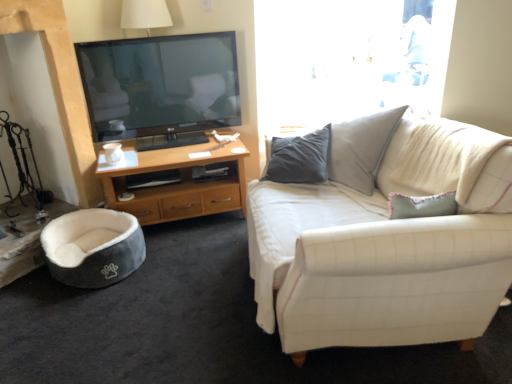
Question: Is point (474, 251) positioned closer to the camera than point (76, 258)?

Choices:
 (A) closer
 (B) farther

Answer: (A)

Question: From a real-world perspective, is white fabric couch at right above or below velvet grey bean bag at lower left?

Choices:
 (A) below
 (B) above

Answer: (B)

Question: Based on their relative distances, which object is nearer to the white matte coffee cup at lower left?

Choices:
 (A) velvet grey bean bag at lower left
 (B) woodendesk at left
 (C) white fabric couch at right

Answer: (B)

Question: Which object is positioned closest to the white fabric couch at right?

Choices:
 (A) white matte coffee cup at lower left
 (B) woodendesk at left
 (C) velvet grey bean bag at lower left

Answer: (B)